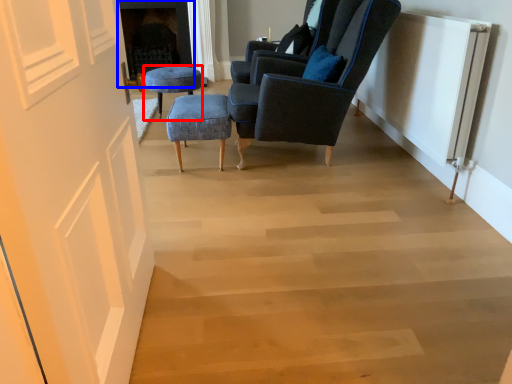
Question: Among these objects, which one is nearest to the camera, stool (highlighted by a red box) or fireplace (highlighted by a blue box)?

Choices:
 (A) stool
 (B) fireplace

Answer: (A)